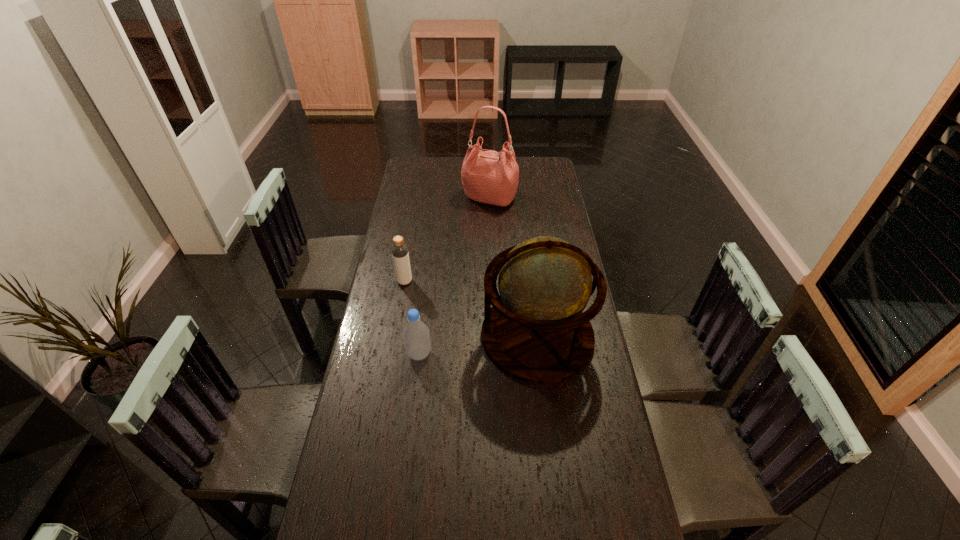
The width and height of the screenshot is (960, 540). I want to click on vacant space situated on the back of the left bottle, so click(x=412, y=242).

The width and height of the screenshot is (960, 540). I want to click on vacant region located on the right of the third object from right to left, so click(524, 354).

Where is `object that is positioned at the right edge`? object that is positioned at the right edge is located at coordinates (536, 332).

This screenshot has height=540, width=960. What are the coordinates of `blank space at the left edge` in the screenshot? It's located at (398, 198).

I want to click on blank space at the right edge of the desktop, so click(588, 374).

Where is `free spot at the far left corner of the desktop`? free spot at the far left corner of the desktop is located at coordinates (411, 160).

The width and height of the screenshot is (960, 540). Identify the location of free region at the far right corner of the desktop. (530, 174).

Locate an element on the screen. Image resolution: width=960 pixels, height=540 pixels. empty space between the third nearest object and the farthest object is located at coordinates (447, 240).

Locate an element on the screen. The image size is (960, 540). free space between the globe and the leftmost object is located at coordinates (471, 309).

Where is `free area in between the globe and the leftmost object`? The width and height of the screenshot is (960, 540). free area in between the globe and the leftmost object is located at coordinates (471, 309).